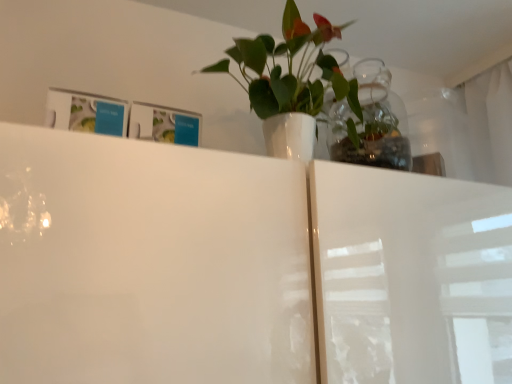
Image resolution: width=512 pixels, height=384 pixels. What do you see at coordinates (371, 122) in the screenshot? I see `transparent glass vase at upper center` at bounding box center [371, 122].

Locate an element on the screen. transparent glass vase at upper center is located at coordinates (371, 122).

From the picture: In order to face white glossy vase at upper center, should I rotate leftwards or rightwards?

It's best to rotate right around 3.948 degrees.

The width and height of the screenshot is (512, 384). I want to click on white glossy vase at upper center, so click(x=290, y=81).

What do you see at coordinates (290, 81) in the screenshot? This screenshot has width=512, height=384. I see `white glossy vase at upper center` at bounding box center [290, 81].

Find the location of a particular element. transparent glass vase at upper center is located at coordinates (371, 122).

Considering the relative positions of white glossy vase at upper center and transparent glass vase at upper center in the image provided, is white glossy vase at upper center to the left or to the right of transparent glass vase at upper center?

In the image, white glossy vase at upper center appears on the left side of transparent glass vase at upper center.

Is white glossy vase at upper center further to the viewer compared to transparent glass vase at upper center?

That is False.

Is point (270, 125) closer to camera compared to point (357, 71)?

Yes, point (270, 125) is in front of point (357, 71).

From the image's perspective, is white glossy vase at upper center located above transparent glass vase at upper center?

Yes, from the image's perspective, white glossy vase at upper center is on top of transparent glass vase at upper center.

From a real-world perspective, is white glossy vase at upper center on top of transparent glass vase at upper center?

Yes, from a real-world perspective, white glossy vase at upper center is above transparent glass vase at upper center.

Which of these two, white glossy vase at upper center or transparent glass vase at upper center, is thinner?

transparent glass vase at upper center.

Is white glossy vase at upper center taller than transparent glass vase at upper center?

Yes.

Considering the sizes of objects white glossy vase at upper center and transparent glass vase at upper center in the image provided, who is smaller, white glossy vase at upper center or transparent glass vase at upper center?

Smaller between the two is transparent glass vase at upper center.

Is white glossy vase at upper center completely or partially outside of transparent glass vase at upper center?

white glossy vase at upper center is positioned outside transparent glass vase at upper center.

Would you say white glossy vase at upper center is a long distance from transparent glass vase at upper center?

No, white glossy vase at upper center is in close proximity to transparent glass vase at upper center.

Is white glossy vase at upper center turned away from transparent glass vase at upper center?

No, white glossy vase at upper center is not facing away from transparent glass vase at upper center.

How different are the orientations of white glossy vase at upper center and transparent glass vase at upper center in degrees?

The angular difference between white glossy vase at upper center and transparent glass vase at upper center is 3.63 degrees.

Identify the location of houseplant on the left of transparent glass vase at upper center. (290, 81).

In the image, is transparent glass vase at upper center on the left side or the right side of white glossy vase at upper center?

transparent glass vase at upper center is to the right of white glossy vase at upper center.

Is transparent glass vase at upper center behind white glossy vase at upper center?

Yes, transparent glass vase at upper center is behind white glossy vase at upper center.

Is point (340, 161) farther from viewer compared to point (267, 51)?

Yes, it is.

From the image's perspective, is transparent glass vase at upper center located above white glossy vase at upper center?

No, from the image's perspective, transparent glass vase at upper center is not above white glossy vase at upper center.

From a real-world perspective, is transparent glass vase at upper center physically located above or below white glossy vase at upper center?

transparent glass vase at upper center is below white glossy vase at upper center.

Is transparent glass vase at upper center wider than white glossy vase at upper center?

In fact, transparent glass vase at upper center might be narrower than white glossy vase at upper center.

In terms of height, does transparent glass vase at upper center look taller or shorter compared to white glossy vase at upper center?

Considering their sizes, transparent glass vase at upper center has less height than white glossy vase at upper center.

Is transparent glass vase at upper center smaller than white glossy vase at upper center?

Yes, transparent glass vase at upper center is smaller than white glossy vase at upper center.

Is white glossy vase at upper center surrounded by transparent glass vase at upper center?

Definitely not — white glossy vase at upper center is not inside transparent glass vase at upper center.

Is transparent glass vase at upper center not near white glossy vase at upper center?

No, transparent glass vase at upper center is not far away from white glossy vase at upper center.

Is transparent glass vase at upper center oriented away from white glossy vase at upper center?

transparent glass vase at upper center is not turned away from white glossy vase at upper center.

I want to click on glass vase located behind the white glossy vase at upper center, so click(371, 122).

This screenshot has height=384, width=512. In order to click on glass vase below the white glossy vase at upper center (from a real-world perspective) in this screenshot , I will do `click(371, 122)`.

Where is `houseplant above the transparent glass vase at upper center (from a real-world perspective)`? The height and width of the screenshot is (384, 512). houseplant above the transparent glass vase at upper center (from a real-world perspective) is located at coordinates (290, 81).